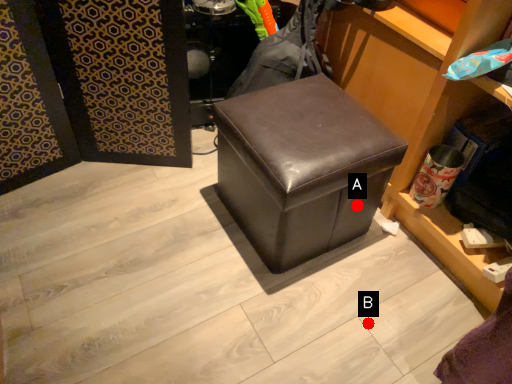
Question: Two points are circled on the image, labeled by A and B beside each circle. Which point is closer to the camera taking this photo?

Choices:
 (A) A is closer
 (B) B is closer

Answer: (B)